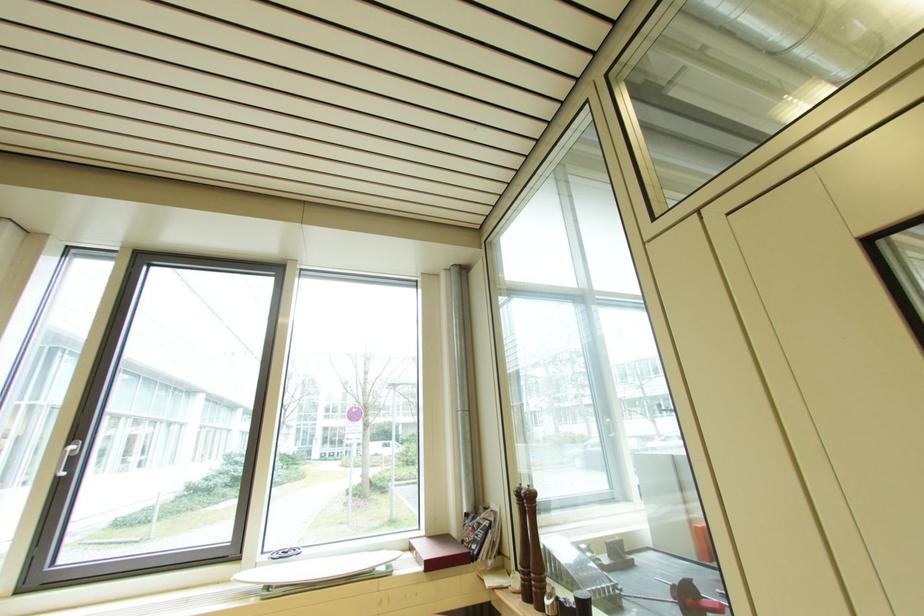
Find where to lift the red and black dumbbell. Please return your answer as a coordinate pair (x, y).

(694, 599)